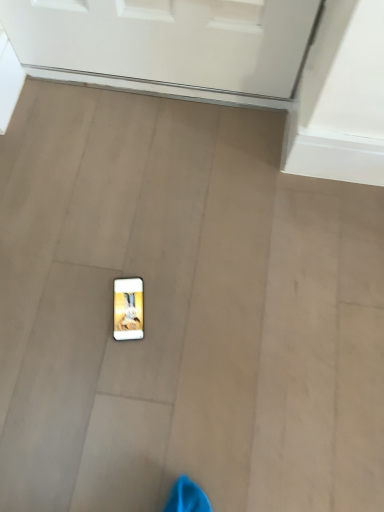
Where is `free spot to the left of matte white phone at center`? The width and height of the screenshot is (384, 512). free spot to the left of matte white phone at center is located at coordinates (65, 307).